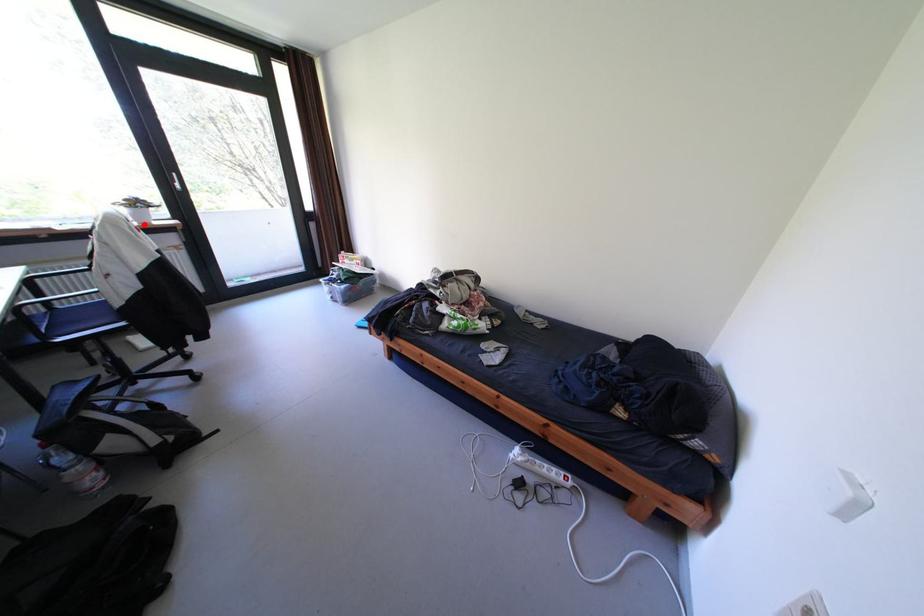
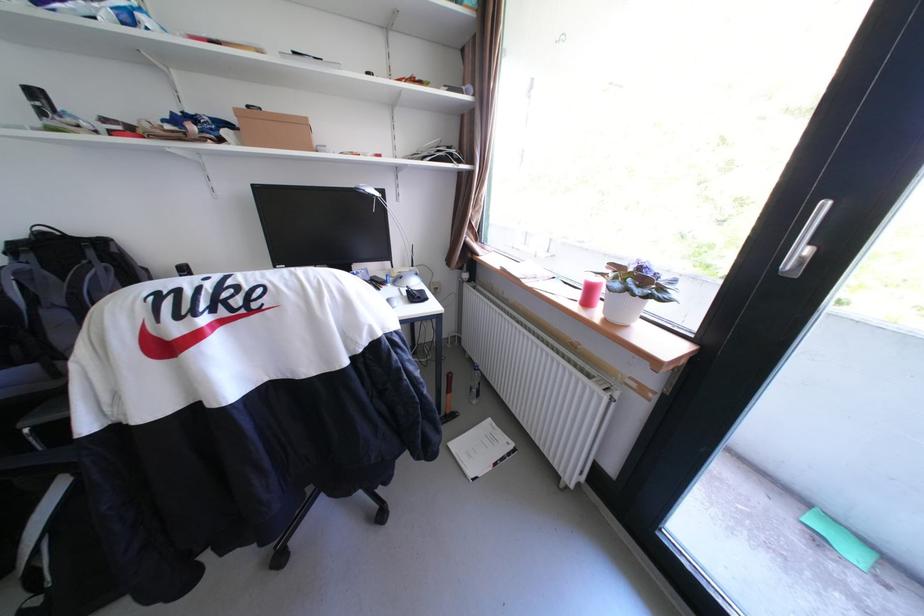
Where in the second image is the point corresponding to the highlighted location from the first image?

(608, 313)